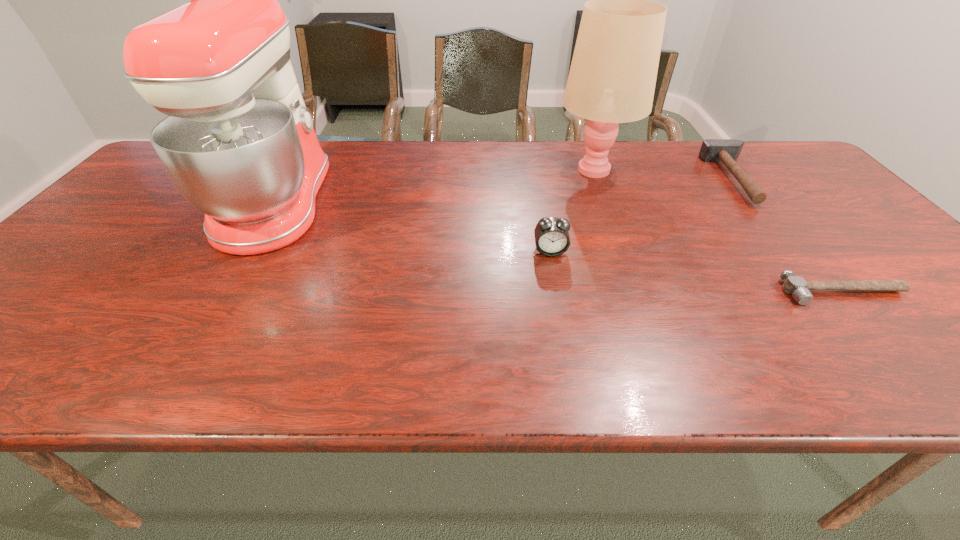
Locate an element on the screen. The image size is (960, 540). the leftmost object is located at coordinates (239, 145).

Locate an element on the screen. The image size is (960, 540). the third object from right to left is located at coordinates (612, 78).

At what (x,y) coordinates should I click in order to perform the action: click on the third shortest object. Please return your answer as a coordinate pair (x, y). This screenshot has height=540, width=960. Looking at the image, I should click on (552, 239).

The image size is (960, 540). Find the location of `the second object from left to right`. the second object from left to right is located at coordinates (552, 239).

Locate an element on the screen. Image resolution: width=960 pixels, height=540 pixels. the second shortest object is located at coordinates (727, 151).

This screenshot has width=960, height=540. Find the location of `the taller hammer`. the taller hammer is located at coordinates (727, 151).

Locate an element on the screen. Image resolution: width=960 pixels, height=540 pixels. the nearest object is located at coordinates (797, 286).

This screenshot has height=540, width=960. Find the location of `the shorter hammer`. the shorter hammer is located at coordinates tap(797, 286).

Identify the location of vacant area situated on the front-facing side of the mixer. (423, 202).

At what (x,y) coordinates should I click in order to perform the action: click on free spot located on the right of the third object from left to right. Please return your answer as a coordinate pair (x, y). Looking at the image, I should click on (653, 169).